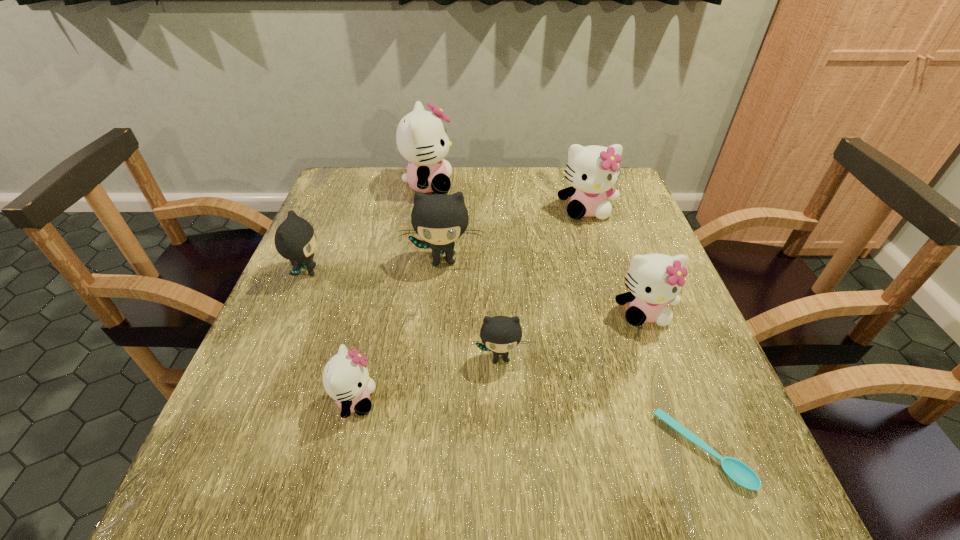
I want to click on the tallest object, so click(421, 138).

The width and height of the screenshot is (960, 540). Find the location of `the biggest white kitten`. the biggest white kitten is located at coordinates (421, 138).

Identify the location of the second biggest white kitten. (592, 171).

You are a GUI agent. You are given a task and a screenshot of the screen. Output one action in this format:
    pyautogui.click(x=<x>, y=<y>)
    Task: Click on the biggest gray kitten
    
    Given the screenshot: What is the action you would take?
    pyautogui.click(x=439, y=219)

I want to click on the third nearest kitten, so click(654, 279).

Locate an element on the screen. The width and height of the screenshot is (960, 540). the third farthest white kitten is located at coordinates (654, 279).

Where is `the leftmost gray kitten`? the leftmost gray kitten is located at coordinates [295, 240].

Where is `the second smallest gray kitten`? the second smallest gray kitten is located at coordinates pos(295,240).

Where is `the nearest kitten`? the nearest kitten is located at coordinates (346, 379).

Identify the location of the nearest white kitten. Image resolution: width=960 pixels, height=540 pixels. (346, 379).